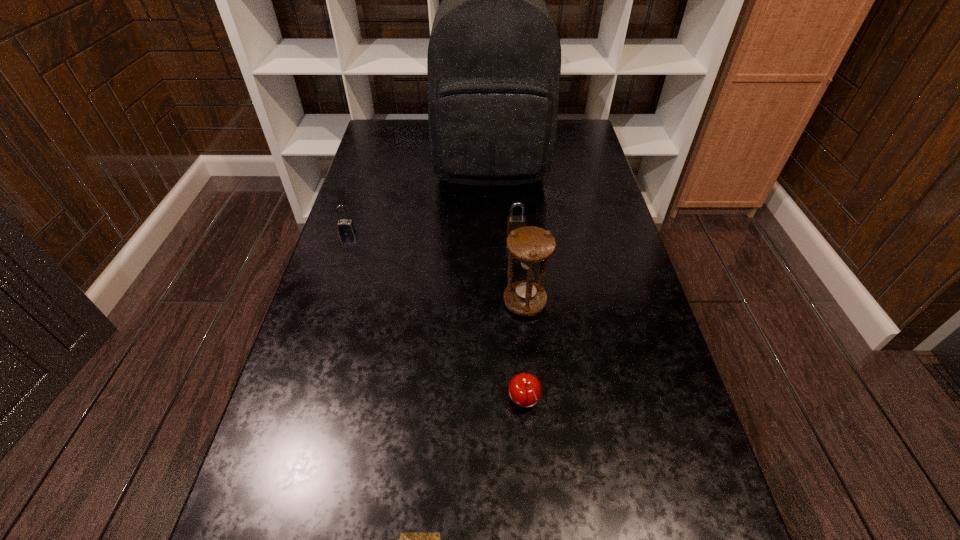
Find the location of a particular element. vacant region located 0.240m on the right of the rightmost padlock is located at coordinates (611, 232).

This screenshot has height=540, width=960. I want to click on vacant point located 0.080m on the shackle of the leftmost padlock, so click(x=340, y=256).

In order to click on vacant position located on the front of the second nearest object in this screenshot , I will do tap(530, 479).

Where is `object located in the far edge section of the desktop`? This screenshot has width=960, height=540. object located in the far edge section of the desktop is located at coordinates (494, 56).

In order to click on object at the left edge in this screenshot , I will do `click(346, 227)`.

Identify the location of vacant space at the left edge of the desktop. The height and width of the screenshot is (540, 960). (304, 532).

The image size is (960, 540). Identify the location of vacant space at the right edge. (613, 455).

Find the location of `blank space at the far left corner`. blank space at the far left corner is located at coordinates (393, 139).

Find the location of `vacant point located between the tallest object and the second shortest object`. vacant point located between the tallest object and the second shortest object is located at coordinates [x=508, y=286].

This screenshot has width=960, height=540. I want to click on vacant space that is in between the backpack and the second nearest object, so click(508, 286).